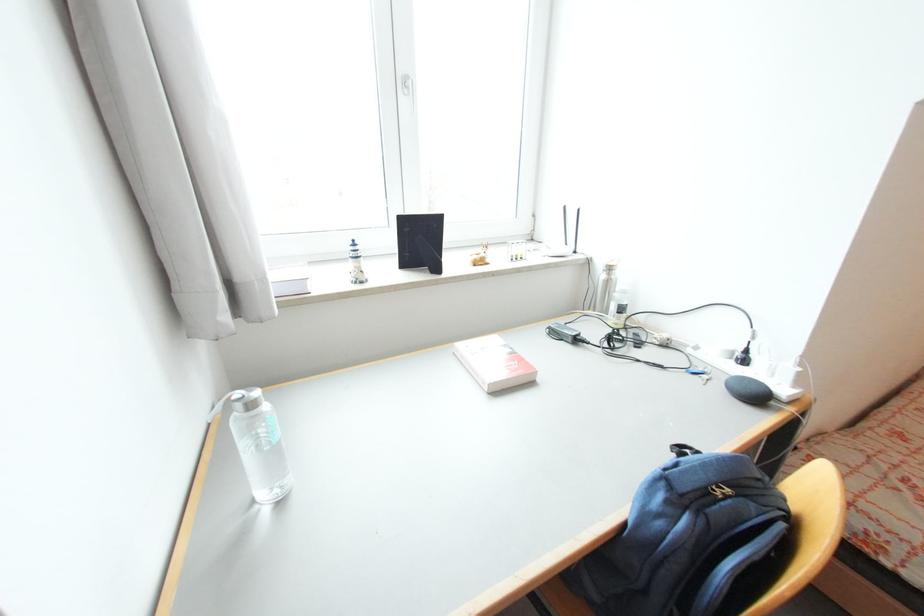
The image size is (924, 616). Describe the element at coordinates (409, 92) in the screenshot. I see `the white window handle` at that location.